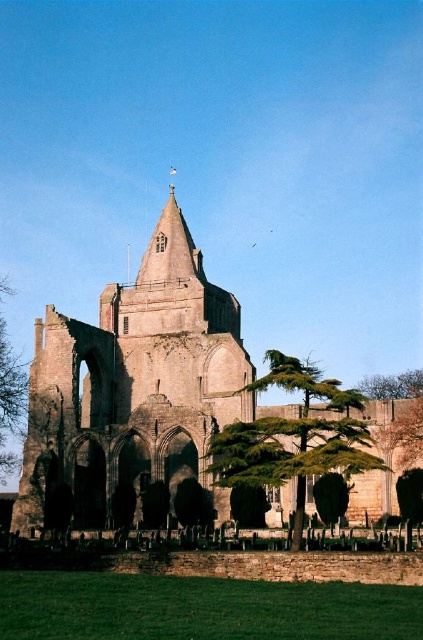
You are standing in the historic church ruins and want to take a photo of both the green textured stone tree at center and the green leafy tree at left. Which tree should you focus on first if you want to include both in your frame without moving the camera?

You should focus on the green textured stone tree at center first because it is located above the green leafy tree at left, so adjusting the camera angle to capture both would require framing from the top downward.